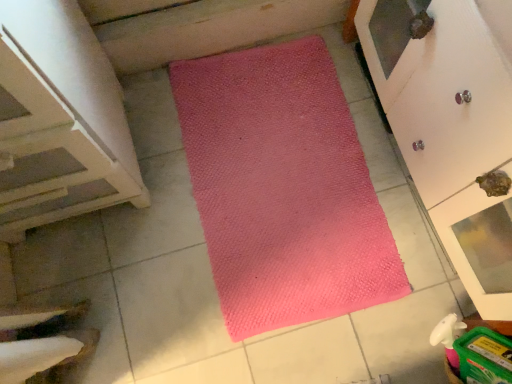
Image resolution: width=512 pixels, height=384 pixels. What do you see at coordinates (452, 126) in the screenshot? I see `matte white cupboard at upper right` at bounding box center [452, 126].

I want to click on pink textured mat at center, so click(283, 188).

Locate an element on the screen. The height and width of the screenshot is (384, 512). white wood stairs at left is located at coordinates (61, 119).

From a real-world perspective, which is physically below, white wood stairs at left or pink textured mat at center?

pink textured mat at center.

Based on the photo, is white wood stairs at left positioned far away from pink textured mat at center?

Actually, white wood stairs at left and pink textured mat at center are a little close together.

Is point (44, 149) positioned after point (352, 300)?

No, it is in front of (352, 300).

From a real-world perspective, is pink textured mat at center beneath white wood stairs at left?

Yes, from a real-world perspective, pink textured mat at center is beneath white wood stairs at left.

Is pink textured mat at center in contact with white wood stairs at left?

There is a gap between pink textured mat at center and white wood stairs at left.

In terms of size, does pink textured mat at center appear bigger or smaller than white wood stairs at left?

pink textured mat at center is smaller than white wood stairs at left.

Which is correct: pink textured mat at center is inside white wood stairs at left, or outside of it?

pink textured mat at center exists outside the volume of white wood stairs at left.

Is matte white cupboard at upper right aimed at white wood stairs at left?

Yes, matte white cupboard at upper right is oriented towards white wood stairs at left.

Are matte white cupboard at upper right and white wood stairs at left located far from each other?

Actually, matte white cupboard at upper right and white wood stairs at left are a little close together.

From the image's perspective, is matte white cupboard at upper right positioned above or below white wood stairs at left?

matte white cupboard at upper right is situated lower than white wood stairs at left in the image.

From the picture: Is white wood stairs at left positioned with its back to matte white cupboard at upper right?

No.

Who is smaller, white wood stairs at left or matte white cupboard at upper right?

matte white cupboard at upper right is smaller.

Image resolution: width=512 pixels, height=384 pixels. Identify the location of cupboard to the right of white wood stairs at left. (452, 126).

Is matte white cupboard at upper right located within white wood stairs at left?

That's incorrect, matte white cupboard at upper right is not inside white wood stairs at left.

Between pink textured mat at center and matte white cupboard at upper right, which one has more height?

matte white cupboard at upper right is taller.

Considering the positions of objects pink textured mat at center and matte white cupboard at upper right in the image provided, who is behind, pink textured mat at center or matte white cupboard at upper right?

pink textured mat at center.

Between point (335, 215) and point (505, 139), which one is positioned in front?

The point (505, 139) is more forward.

Is pink textured mat at center facing towards matte white cupboard at upper right?

No, pink textured mat at center is not turned towards matte white cupboard at upper right.

From a real-world perspective, which is physically below, matte white cupboard at upper right or pink textured mat at center?

In real-world perspective, pink textured mat at center is lower.

From the image's perspective, is matte white cupboard at upper right positioned above or below pink textured mat at center?

Based on their image positions, matte white cupboard at upper right is located above pink textured mat at center.

Looking at this image, is matte white cupboard at upper right completely or partially outside of pink textured mat at center?

Yes, matte white cupboard at upper right is located beyond the bounds of pink textured mat at center.

Which object is further away from the camera, matte white cupboard at upper right or pink textured mat at center?

pink textured mat at center is further from the camera.

This screenshot has height=384, width=512. What are the coordinates of `mat behind the white wood stairs at left` in the screenshot? It's located at (283, 188).

Find the location of a particular element. This screenshot has height=384, width=512. cabinetry in front of the pink textured mat at center is located at coordinates (61, 119).

Considering their positions, is white wood stairs at left positioned further to matte white cupboard at upper right than pink textured mat at center?

The object further to matte white cupboard at upper right is white wood stairs at left.

When comparing their distances from pink textured mat at center, does white wood stairs at left or matte white cupboard at upper right seem closer?

Based on the image, matte white cupboard at upper right appears to be nearer to pink textured mat at center.

Looking at the image, which one is located further to matte white cupboard at upper right, pink textured mat at center or white wood stairs at left?

white wood stairs at left is further to matte white cupboard at upper right.

Which object lies nearer to the anchor point white wood stairs at left, matte white cupboard at upper right or pink textured mat at center?

pink textured mat at center is closer to white wood stairs at left.

Which object lies nearer to the anchor point pink textured mat at center, matte white cupboard at upper right or white wood stairs at left?

matte white cupboard at upper right lies closer to pink textured mat at center than the other object.

From the image, which object appears to be nearer to white wood stairs at left, pink textured mat at center or matte white cupboard at upper right?

pink textured mat at center is positioned closer to the anchor white wood stairs at left.

The image size is (512, 384). Find the location of `mat between white wood stairs at left and matte white cupboard at upper right from left to right`. mat between white wood stairs at left and matte white cupboard at upper right from left to right is located at coordinates (283, 188).